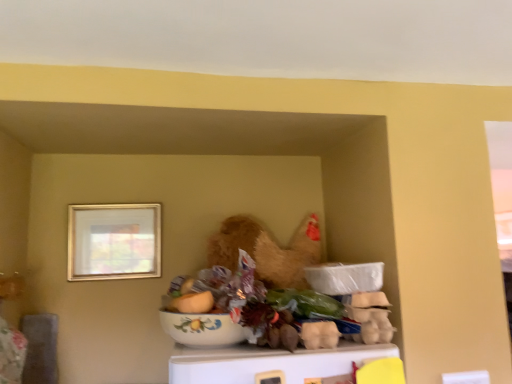
Question: Does floral ceramic bowl at center, which is the first food in left-to-right order, have a greater height compared to gold metallic picture frame at upper left?

Choices:
 (A) yes
 (B) no

Answer: (B)

Question: Is floral ceramic bowl at center, the 2th food in the bottom-to-top sequence, further to the viewer compared to gold metallic picture frame at upper left?

Choices:
 (A) yes
 (B) no

Answer: (B)

Question: Can you confirm if floral ceramic bowl at center, which is the first food in left-to-right order, is bigger than gold metallic picture frame at upper left?

Choices:
 (A) yes
 (B) no

Answer: (B)

Question: From the image's perspective, is floral ceramic bowl at center, which is the first food in left-to-right order, under gold metallic picture frame at upper left?

Choices:
 (A) no
 (B) yes

Answer: (B)

Question: Based on their positions, is floral ceramic bowl at center, which is the second food from right to left, located to the left or right of white cardboard egg carton at center, positioned as the first food in bottom-to-top order?

Choices:
 (A) left
 (B) right

Answer: (A)

Question: Choose the correct answer: Is floral ceramic bowl at center, the 2th food in the bottom-to-top sequence, inside white cardboard egg carton at center, positioned as the second food in left-to-right order, or outside it?

Choices:
 (A) inside
 (B) outside

Answer: (B)

Question: From a real-world perspective, is floral ceramic bowl at center, the 2th food in the bottom-to-top sequence, physically located above or below white cardboard egg carton at center, positioned as the second food in left-to-right order?

Choices:
 (A) above
 (B) below

Answer: (A)

Question: Looking at their shapes, would you say floral ceramic bowl at center, which is the first food in left-to-right order, is wider or thinner than white cardboard egg carton at center, the 2th food in the top-to-bottom sequence?

Choices:
 (A) wide
 (B) thin

Answer: (B)

Question: From their relative heights in the image, would you say floral ceramic bowl at center, the 2th food in the bottom-to-top sequence, is taller or shorter than gold metallic picture frame at upper left?

Choices:
 (A) tall
 (B) short

Answer: (B)

Question: Is point (187, 311) positioned closer to the camera than point (70, 274)?

Choices:
 (A) farther
 (B) closer

Answer: (B)

Question: Looking at the image, does floral ceramic bowl at center, which is the first food in left-to-right order, seem bigger or smaller compared to gold metallic picture frame at upper left?

Choices:
 (A) small
 (B) big

Answer: (A)

Question: Is floral ceramic bowl at center, which is the second food from right to left, to the left or to the right of gold metallic picture frame at upper left in the image?

Choices:
 (A) right
 (B) left

Answer: (A)

Question: In terms of height, does white glossy bowl at center look taller or shorter compared to gold metallic picture frame at upper left?

Choices:
 (A) tall
 (B) short

Answer: (B)

Question: In the image, is white glossy bowl at center positioned in front of or behind gold metallic picture frame at upper left?

Choices:
 (A) behind
 (B) front

Answer: (B)